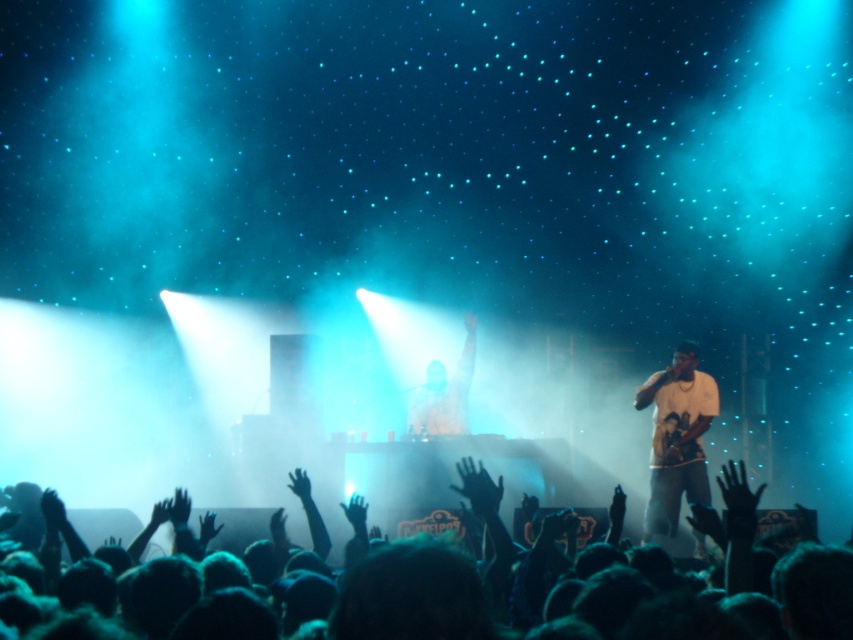
Which is more to the right, black hair at lower center or white cotton shirt at center?

Positioned to the right is white cotton shirt at center.

Between point (360, 598) and point (692, 380), which one is positioned behind?

Point (692, 380)

I want to click on black hair at lower center, so click(579, 582).